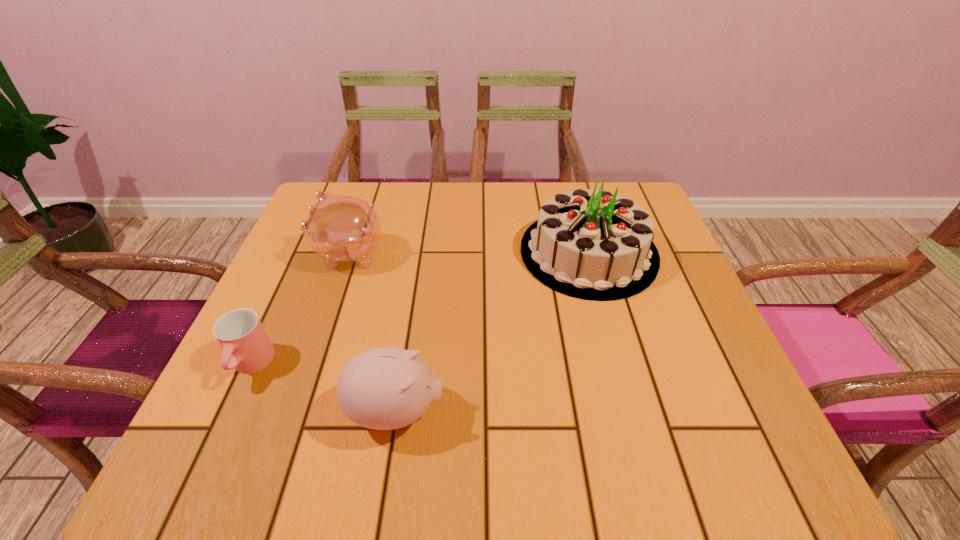
Locate an element on the screen. Image resolution: width=960 pixels, height=540 pixels. the tallest object is located at coordinates (590, 244).

Where is `the rightmost object`? Image resolution: width=960 pixels, height=540 pixels. the rightmost object is located at coordinates (590, 244).

Image resolution: width=960 pixels, height=540 pixels. Find the location of `the third shortest object`. the third shortest object is located at coordinates (338, 228).

You are a GUI agent. You are given a task and a screenshot of the screen. Output one action in this format:
    pyautogui.click(x=<x>, y=<y>)
    Task: Click on the taller piggy bank
    This screenshot has height=540, width=960.
    Given the screenshot: What is the action you would take?
    pyautogui.click(x=338, y=228)

Locate an element on the screen. This screenshot has height=540, width=960. the shorter piggy bank is located at coordinates (386, 388).

At what (x,y) coordinates should I click in order to perform the action: click on the nearer piggy bank. Please return your answer as a coordinate pair (x, y). The width and height of the screenshot is (960, 540). Looking at the image, I should click on (386, 388).

You are a GUI agent. You are given a task and a screenshot of the screen. Output one action in this format:
    pyautogui.click(x=<x>, y=<y>)
    Task: Click on the cup
    
    Given the screenshot: What is the action you would take?
    pyautogui.click(x=240, y=333)

At what (x,y) coordinates should I click in order to perform the action: click on free space located on the left of the birthday cake. Please return your answer as a coordinate pair (x, y). Looking at the image, I should click on (420, 252).

What are the coordinates of `vacant space located at the snout of the nearer piggy bank` in the screenshot? It's located at (658, 411).

The image size is (960, 540). What are the coordinates of `blank space located on the side of the shortest object with the handle` in the screenshot? It's located at (228, 416).